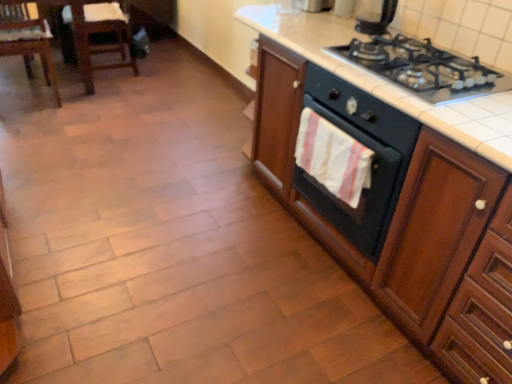
Question: Can you confirm if white cotton hand towel at center-right is bigger than black glass gas stove at upper right?

Choices:
 (A) no
 (B) yes

Answer: (A)

Question: Could you tell me if white cotton hand towel at center-right is turned towards black glass gas stove at upper right?

Choices:
 (A) yes
 (B) no

Answer: (B)

Question: Is white cotton hand towel at center-right outside of black glass gas stove at upper right?

Choices:
 (A) yes
 (B) no

Answer: (A)

Question: Can you confirm if white cotton hand towel at center-right is positioned to the left of black glass gas stove at upper right?

Choices:
 (A) yes
 (B) no

Answer: (A)

Question: Would you say white cotton hand towel at center-right is a long distance from black glass gas stove at upper right?

Choices:
 (A) yes
 (B) no

Answer: (B)

Question: From their relative heights in the image, would you say black glossy kettle at upper right is taller or shorter than wooden cabinet at right?

Choices:
 (A) short
 (B) tall

Answer: (A)

Question: From a real-world perspective, is black glossy kettle at upper right physically located above or below wooden cabinet at right?

Choices:
 (A) above
 (B) below

Answer: (A)

Question: Considering the positions of point (364, 28) and point (471, 246), is point (364, 28) closer or farther from the camera than point (471, 246)?

Choices:
 (A) farther
 (B) closer

Answer: (A)

Question: In terms of width, does black glossy kettle at upper right look wider or thinner when compared to wooden cabinet at right?

Choices:
 (A) wide
 (B) thin

Answer: (B)

Question: Based on their sizes in the image, would you say black matte oven at center-right is bigger or smaller than wooden cabinet at right?

Choices:
 (A) big
 (B) small

Answer: (B)

Question: From a real-world perspective, is black matte oven at center-right physically located above or below wooden cabinet at right?

Choices:
 (A) below
 (B) above

Answer: (B)

Question: Is black matte oven at center-right inside the boundaries of wooden cabinet at right, or outside?

Choices:
 (A) outside
 (B) inside

Answer: (B)

Question: Is black matte oven at center-right taller or shorter than wooden cabinet at right?

Choices:
 (A) tall
 (B) short

Answer: (B)

Question: Looking at the image, does wooden cabinet at right seem bigger or smaller compared to black glass gas stove at upper right?

Choices:
 (A) big
 (B) small

Answer: (A)

Question: In terms of width, does wooden cabinet at right look wider or thinner when compared to black glass gas stove at upper right?

Choices:
 (A) wide
 (B) thin

Answer: (A)